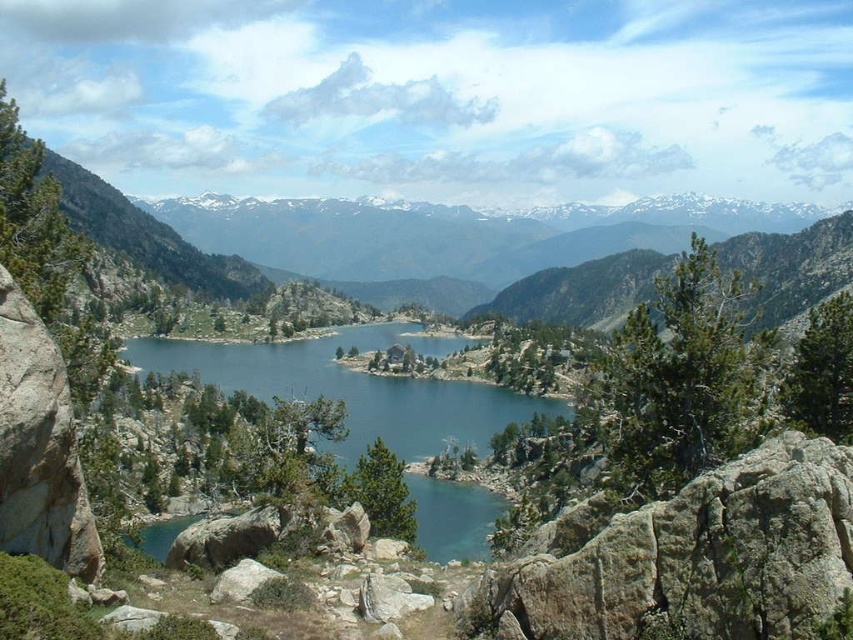
What do you see at coordinates (39, 445) in the screenshot?
I see `brown rough rock at left` at bounding box center [39, 445].

Is brown rough rock at left further to camera compared to gray rock at lower left?

No, it is not.

Who is more distant from viewer, [42,497] or [225,596]?

The point [225,596] is behind.

Identify the location of brown rough rock at left. (39, 445).

Who is lower down, green grassy mountain at center or brown rough rock at left?

brown rough rock at left is below.

Is green grassy mountain at center taller than brown rough rock at left?

Yes, green grassy mountain at center is taller than brown rough rock at left.

Is point (241, 225) closer to camera compared to point (61, 422)?

No, (241, 225) is behind (61, 422).

Locate an element on the screen. The height and width of the screenshot is (640, 853). green grassy mountain at center is located at coordinates (374, 250).

Does green grassy mountain at center have a lesser height compared to rocky cliff at lower right?

Incorrect, green grassy mountain at center's height does not fall short of rocky cliff at lower right's.

Find the location of a particular element. Image resolution: width=853 pixels, height=640 pixels. green grassy mountain at center is located at coordinates (374, 250).

Locate an element on the screen. The height and width of the screenshot is (640, 853). green grassy mountain at center is located at coordinates (374, 250).